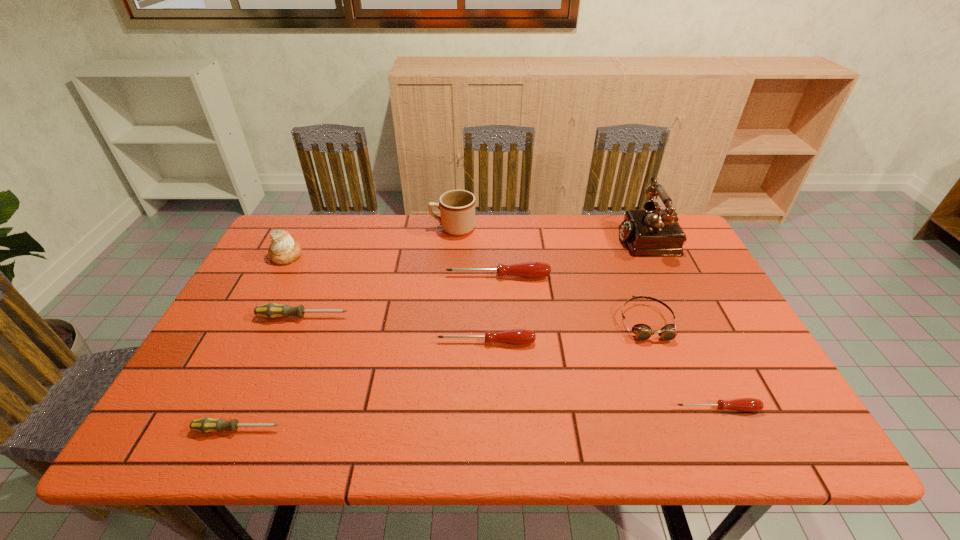
Find the location of a particular element. The width and height of the screenshot is (960, 540). blank space located 0.240m on the side of the brown mug with the handle is located at coordinates (357, 228).

Where is `free space located 0.370m on the side of the brown mug with the handle`? free space located 0.370m on the side of the brown mug with the handle is located at coordinates 318,228.

You are a GUI agent. You are given a task and a screenshot of the screen. Output one action in this format:
    pyautogui.click(x=<x>, y=<y>)
    Task: Click on the free point located on the front of the seventh shortest object
    
    Given the screenshot: What is the action you would take?
    pyautogui.click(x=232, y=356)

Where is `vacant space situated 0.390m on the front of the farthest screwdriver`? The width and height of the screenshot is (960, 540). vacant space situated 0.390m on the front of the farthest screwdriver is located at coordinates (504, 400).

Identify the location of free space located 0.150m through the lenses of the goggles. (675, 395).

This screenshot has height=540, width=960. In order to click on vacant space located 0.070m at the tip of the bigger gray screwdriver in this screenshot , I will do `click(376, 317)`.

In order to click on vacant space located 0.100m on the left of the second smallest red screwdriver in this screenshot , I will do `click(396, 342)`.

The height and width of the screenshot is (540, 960). I want to click on vacant space situated 0.210m at the tip of the nearest screwdriver, so click(384, 429).

The height and width of the screenshot is (540, 960). Identify the location of vacant position located 0.380m on the left of the fourth farthest screwdriver. [497, 408].

Where is `telephone that is at the far edge`? telephone that is at the far edge is located at coordinates (652, 232).